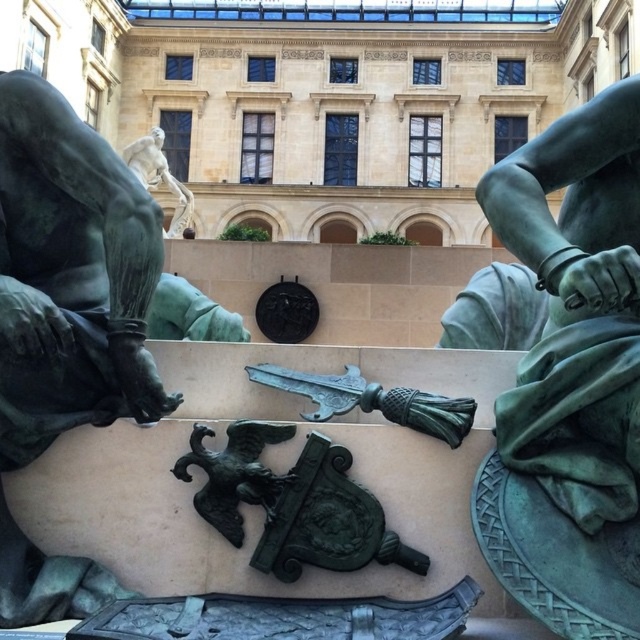
Question: Does bronze statue at left appear over bronze statue at upper center?

Choices:
 (A) yes
 (B) no

Answer: (B)

Question: Is bronze statue at left to the right of bronze statue at upper center from the viewer's perspective?

Choices:
 (A) no
 (B) yes

Answer: (B)

Question: Which of the following is the farthest from the observer?

Choices:
 (A) (128, 157)
 (B) (93, 403)

Answer: (A)

Question: Is bronze statue at left closer to the viewer compared to bronze statue at upper center?

Choices:
 (A) no
 (B) yes

Answer: (B)